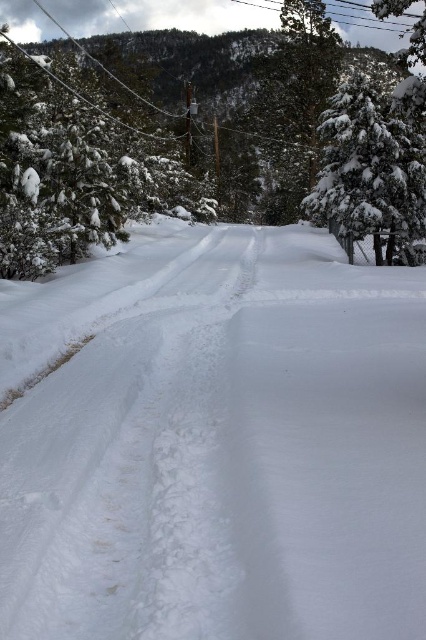
Question: From the image, what is the correct spatial relationship of white snow ski slope at center in relation to white snow-covered tree at right?

Choices:
 (A) above
 (B) below

Answer: (B)

Question: Estimate the real-world distances between objects in this image. Which object is farther from the white snow-covered tree at right?

Choices:
 (A) snow-covered evergreen tree at center
 (B) white snow ski slope at center

Answer: (A)

Question: Which point appears farthest from the camera in this image?

Choices:
 (A) (141, 332)
 (B) (351, 260)

Answer: (B)

Question: Does snow-covered evergreen tree at center appear under white snow-covered tree at right?

Choices:
 (A) no
 (B) yes

Answer: (A)

Question: Which of the following is the closest to the observer?

Choices:
 (A) white snow ski slope at center
 (B) snow-covered evergreen tree at center
 (C) white snow-covered tree at right

Answer: (A)

Question: Is white snow ski slope at center wider than white snow-covered tree at right?

Choices:
 (A) no
 (B) yes

Answer: (B)